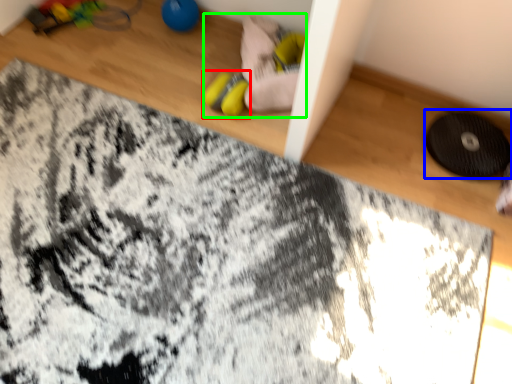
Question: Estimate the real-world distances between objects in this image. Which object is farther from footwear (highlighted by a red box), mat (highlighted by a blue box) or toy (highlighted by a green box)?

Choices:
 (A) mat
 (B) toy

Answer: (A)